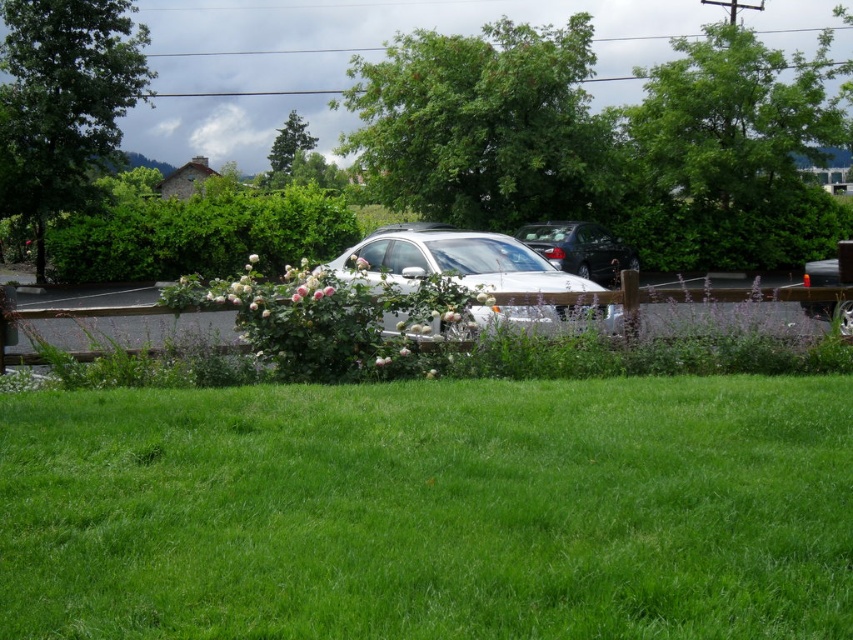
You are standing in the middle of the lawn and want to take a photo of both the silver car and the black car. You notice two points marked on the ground at coordinates point (x=534, y=131) and point (x=547, y=269). Which point should you stand on to ensure both cars are in your camera frame?

You should stand on point (x=534, y=131) because it is closer to the camera, allowing you to capture both the silver car and the black car within the frame.

You are a delivery person trying to park your van in the parking spot behind the satin white sedan at center. The van is 2 meters tall. Can you fit your van there without hitting the green leafy tree at upper center?

The green leafy tree at upper center is located above the satin white sedan at center, so the van might hit the tree if it is taller than the sedan. However, the exact height difference isn not provided, so it is uncertain.